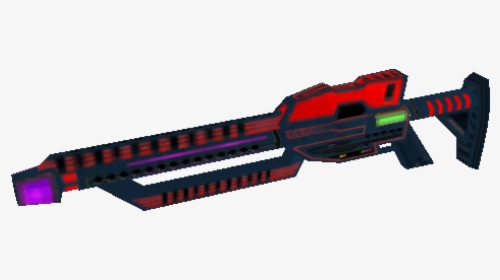
At what (x,y) coordinates should I click in order to perform the action: click on green light. Please return your answer as a coordinate pair (x, y). Looking at the image, I should click on (395, 118).